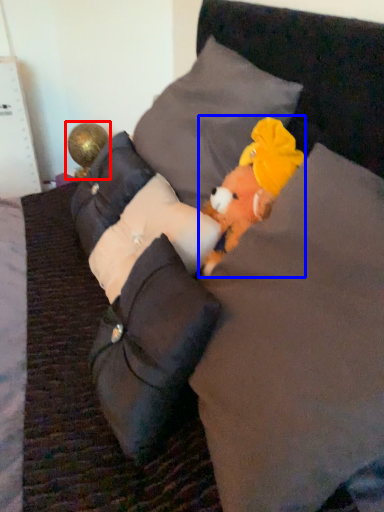
Question: Which object appears closest to the camera in this image, toy (highlighted by a red box) or toy (highlighted by a blue box)?

Choices:
 (A) toy
 (B) toy

Answer: (B)